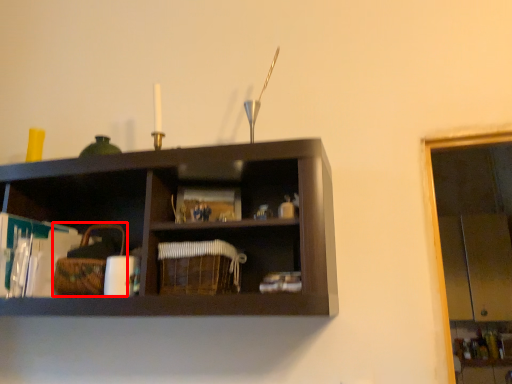
Question: From the image's perspective, where is basket (annotated by the red box) located in relation to basket in the image?

Choices:
 (A) above
 (B) below

Answer: (A)